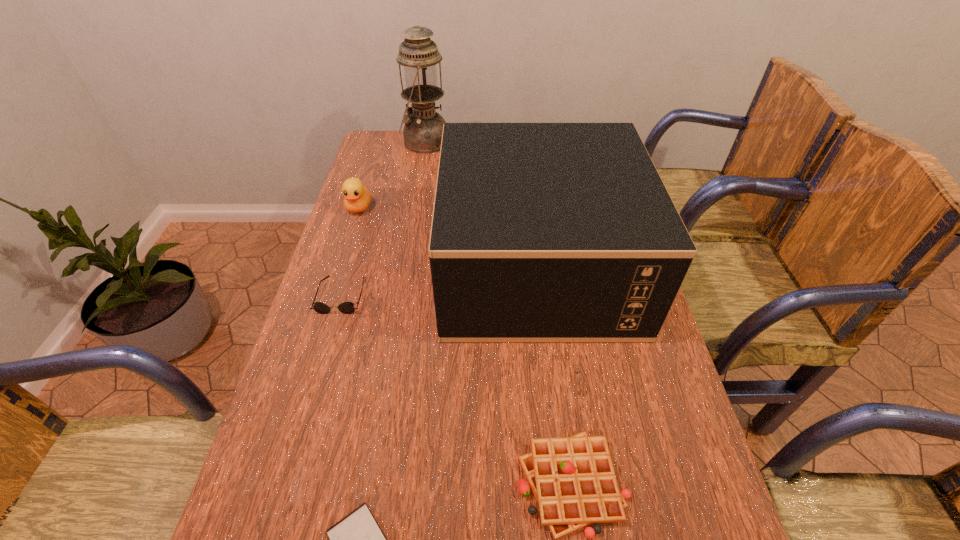
Where is `the tallest object`? the tallest object is located at coordinates (423, 128).

Find the location of a particular element. the farthest object is located at coordinates (423, 128).

I want to click on box, so click(541, 232).

Locate an element on the screen. the third tallest object is located at coordinates (357, 198).

Identify the location of sunglasses. (346, 307).

Find the location of `vacant space located on the front of the farthest object`. vacant space located on the front of the farthest object is located at coordinates (419, 180).

Identify the location of vacant space situated on the front-facing side of the box. click(x=408, y=267).

You are a GUI agent. You are given a task and a screenshot of the screen. Output one action in this format:
    pyautogui.click(x=<x>, y=<y>)
    Task: Click on the blank space located on the front-facing side of the box
    The image size is (960, 540).
    Given the screenshot: What is the action you would take?
    pyautogui.click(x=378, y=267)

Image resolution: width=960 pixels, height=540 pixels. What are the coordinates of `free space located on the front-facing side of the box` in the screenshot? It's located at (331, 267).

Find the location of a particular element. Image resolution: width=960 pixels, height=540 pixels. free space located on the face of the fourth shortest object is located at coordinates (324, 321).